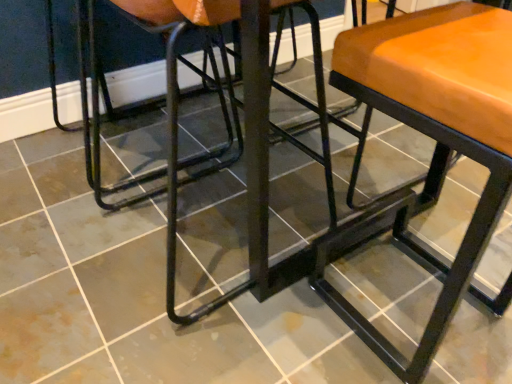
Locate an element on the screen. The width and height of the screenshot is (512, 384). free region under matte orange cushioned stool at center (from a real-world perspective) is located at coordinates (415, 309).